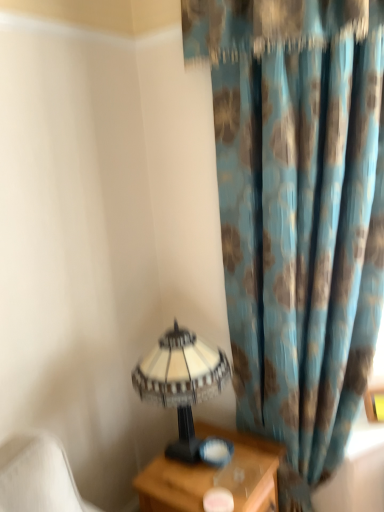
Question: Does yellow matte picture frame at right have a greater height compared to white textured lampshade at lower left?

Choices:
 (A) no
 (B) yes

Answer: (A)

Question: Is yellow matte picture frame at right positioned behind white textured lampshade at lower left?

Choices:
 (A) yes
 (B) no

Answer: (A)

Question: Is yellow matte picture frame at right to the right of white textured lampshade at lower left from the viewer's perspective?

Choices:
 (A) yes
 (B) no

Answer: (A)

Question: Is yellow matte picture frame at right smaller than white textured lampshade at lower left?

Choices:
 (A) no
 (B) yes

Answer: (B)

Question: From the image's perspective, is yellow matte picture frame at right on white textured lampshade at lower left?

Choices:
 (A) yes
 (B) no

Answer: (B)

Question: From the image's perspective, would you say yellow matte picture frame at right is shown under white textured lampshade at lower left?

Choices:
 (A) yes
 (B) no

Answer: (A)

Question: Is wooden nightstand at lower right far away from white textured lampshade at lower left?

Choices:
 (A) no
 (B) yes

Answer: (A)

Question: Does wooden nightstand at lower right appear on the right side of white textured lampshade at lower left?

Choices:
 (A) yes
 (B) no

Answer: (A)

Question: Is wooden nightstand at lower right outside white textured lampshade at lower left?

Choices:
 (A) yes
 (B) no

Answer: (A)

Question: Can you confirm if wooden nightstand at lower right is thinner than white textured lampshade at lower left?

Choices:
 (A) no
 (B) yes

Answer: (A)

Question: Is wooden nightstand at lower right behind white textured lampshade at lower left?

Choices:
 (A) no
 (B) yes

Answer: (A)

Question: From the image's perspective, does wooden nightstand at lower right appear higher than white textured lampshade at lower left?

Choices:
 (A) no
 (B) yes

Answer: (A)

Question: From the image's perspective, would you say yellow matte picture frame at right is positioned over wooden nightstand at lower right?

Choices:
 (A) no
 (B) yes

Answer: (B)